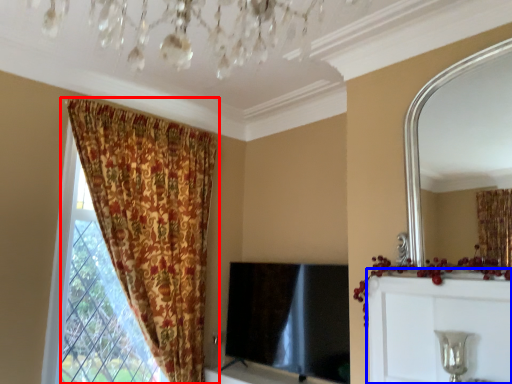
Question: Which of the following is the farthest to the observer, curtain (highlighted by a red box) or dresser (highlighted by a blue box)?

Choices:
 (A) curtain
 (B) dresser

Answer: (A)